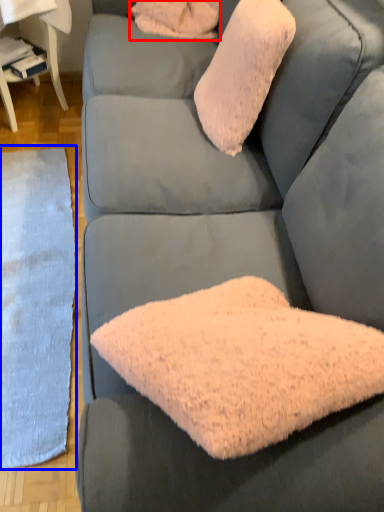
Question: Which of the following is the closest to the observer, pillow (highlighted by a red box) or mat (highlighted by a blue box)?

Choices:
 (A) pillow
 (B) mat

Answer: (B)